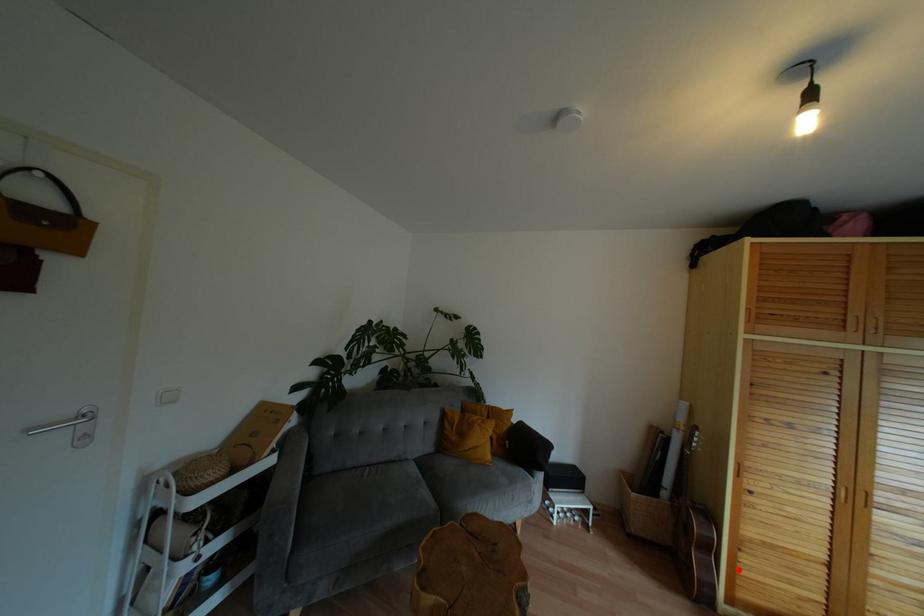
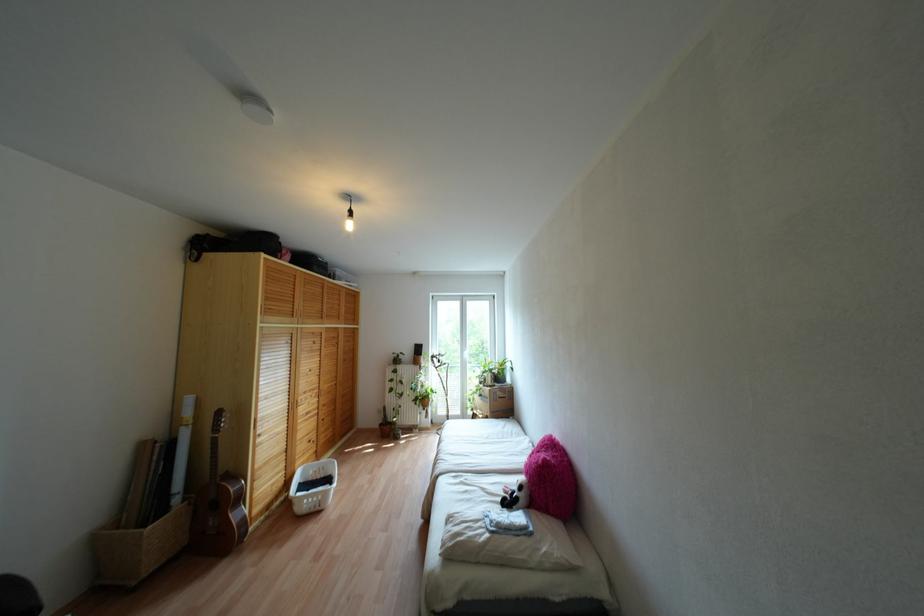
Locate, in the second image, the point that corresponds to the highlighted location in the first image.

(253, 495)